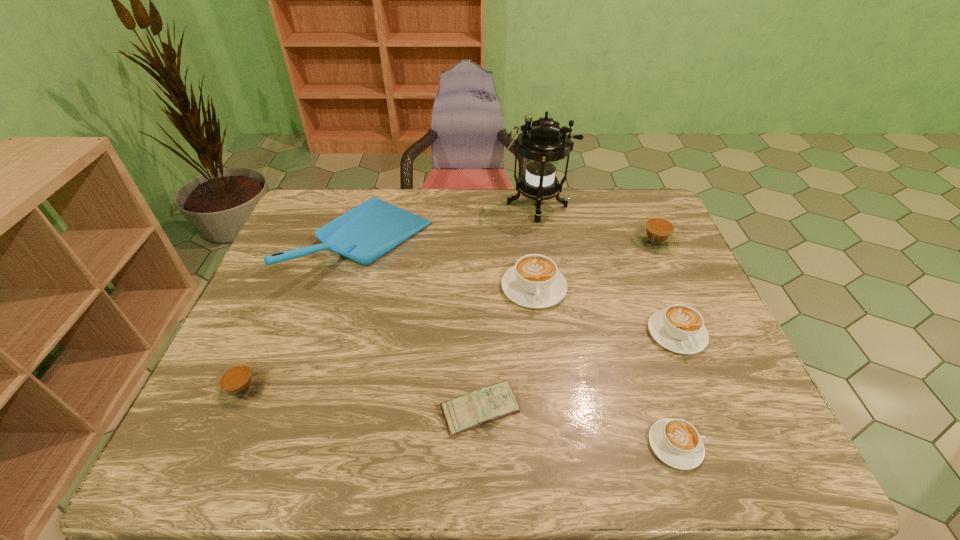
Find the location of `vacant space situated on the side of the smallest white cappuccino with the handle`. vacant space situated on the side of the smallest white cappuccino with the handle is located at coordinates (746, 446).

Locate an element on the screen. lantern that is at the far edge is located at coordinates (542, 143).

This screenshot has width=960, height=540. What are the coordinates of `dustpan that is positioned at the far edge` in the screenshot? It's located at (365, 233).

Locate an element on the screen. cappuccino that is at the far edge is located at coordinates (657, 235).

I want to click on diary that is at the near edge, so click(476, 408).

What are the coordinates of `cappuccino present at the near edge` in the screenshot? It's located at (676, 442).

Where is `dustpan at the left edge`? Image resolution: width=960 pixels, height=540 pixels. dustpan at the left edge is located at coordinates (365, 233).

The height and width of the screenshot is (540, 960). Identify the location of cappuccino that is positioned at the left edge. (238, 383).

You are a GUI agent. You are given a task and a screenshot of the screen. Output one action in this format:
    pyautogui.click(x=<x>, y=<y>)
    Task: Click on the object positioned at the far left corner
    
    Given the screenshot: What is the action you would take?
    pyautogui.click(x=365, y=233)

At what (x,y) coordinates should I click in order to perform the action: click on object that is at the far right corner. Please return your answer as a coordinate pair (x, y). Image resolution: width=960 pixels, height=540 pixels. Looking at the image, I should click on (657, 235).